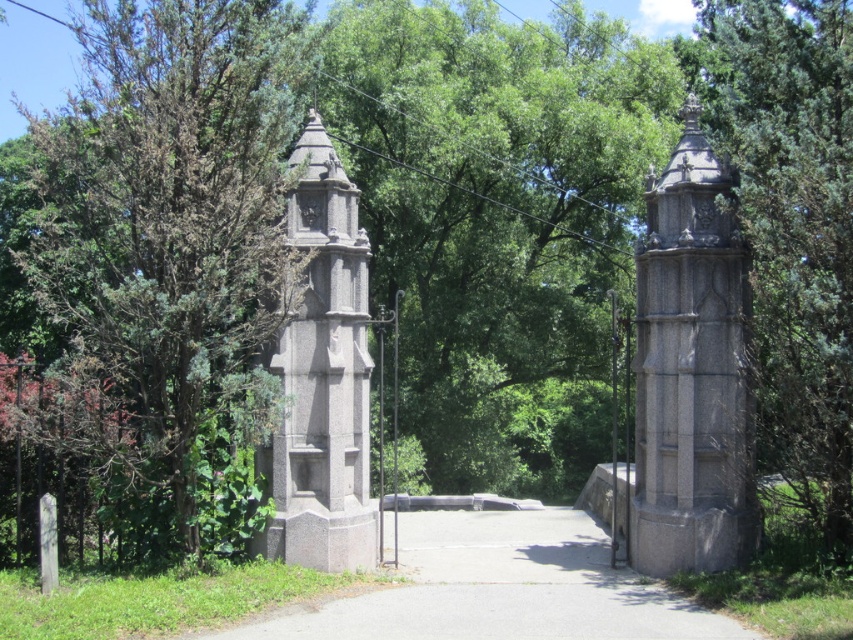
In the scene shown: You are a visitor walking along the pathway and notice two structures at the center of the scene. Which one is taller between the green textured stone pillar at center and the granite tower at center?

The green textured stone pillar at center is taller than the granite tower at center.

You are a landscape architect designing a new garden pathway. You need to place a decorative pillar along the existing gray concrete path at center. The green textured stone pillar at center is available. Considering the spatial relationship between them, will the pillar fit on the path without overhanging? Explain your reasoning.

The green textured stone pillar at center is thinner than the gray concrete path at center. Since the pillar is thinner, it will fit on the path without overhanging as its width is smaller than the path itself.

You are standing at the entrance of the pathway and want to walk towards the bridge in the background. Which point, point 1 at (743,106) or point 2 at (509,588), will you reach first?

You will reach point 2 at (509,588) first because it is closer to you than point 1 at (743,106), which is further away.